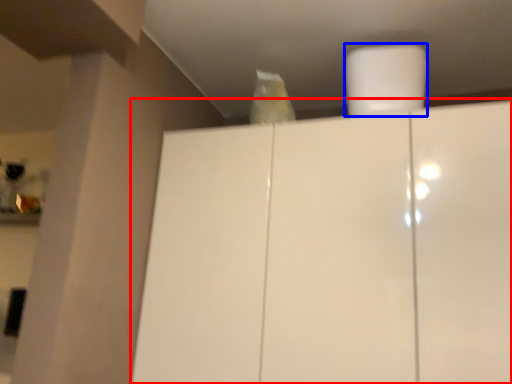
Question: Which point is further to the camera, cupboard (highlighted by a red box) or paper towel (highlighted by a blue box)?

Choices:
 (A) cupboard
 (B) paper towel

Answer: (B)